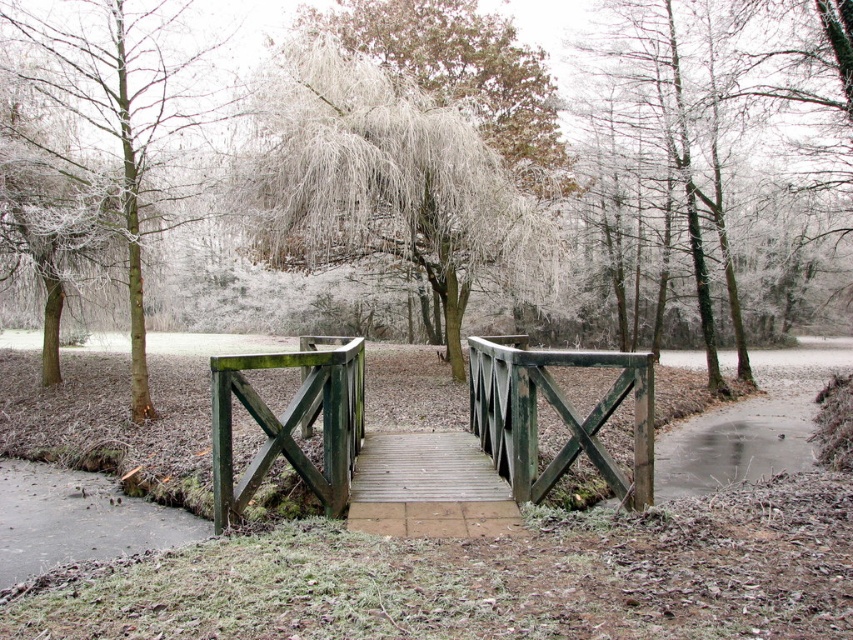
Question: Does green wood bridge at center appear on the left side of green wood tree at left?

Choices:
 (A) yes
 (B) no

Answer: (B)

Question: Which point is farther from the camera taking this photo?

Choices:
 (A) (370, 122)
 (B) (498, 413)

Answer: (A)

Question: Which point appears farthest from the camera in this image?

Choices:
 (A) (161, 12)
 (B) (527, 253)

Answer: (B)

Question: Among these points, which one is farthest from the camera?

Choices:
 (A) (396, 122)
 (B) (38, 33)
 (C) (395, 520)

Answer: (A)

Question: Does green wood bridge at center appear on the left side of wooden bridge at center?

Choices:
 (A) yes
 (B) no

Answer: (B)

Question: Is green wood bridge at center closer to camera compared to wooden bridge at center?

Choices:
 (A) yes
 (B) no

Answer: (B)